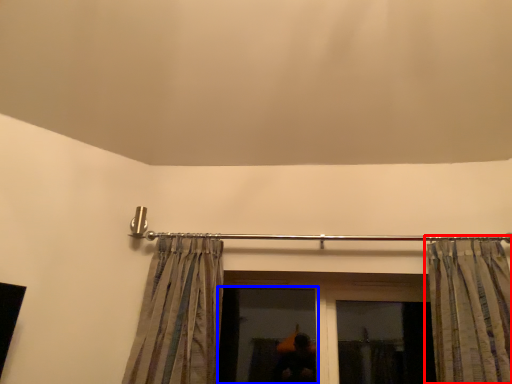
Question: Among these objects, which one is farthest to the camera, curtain (highlighted by a red box) or window (highlighted by a blue box)?

Choices:
 (A) curtain
 (B) window

Answer: (B)